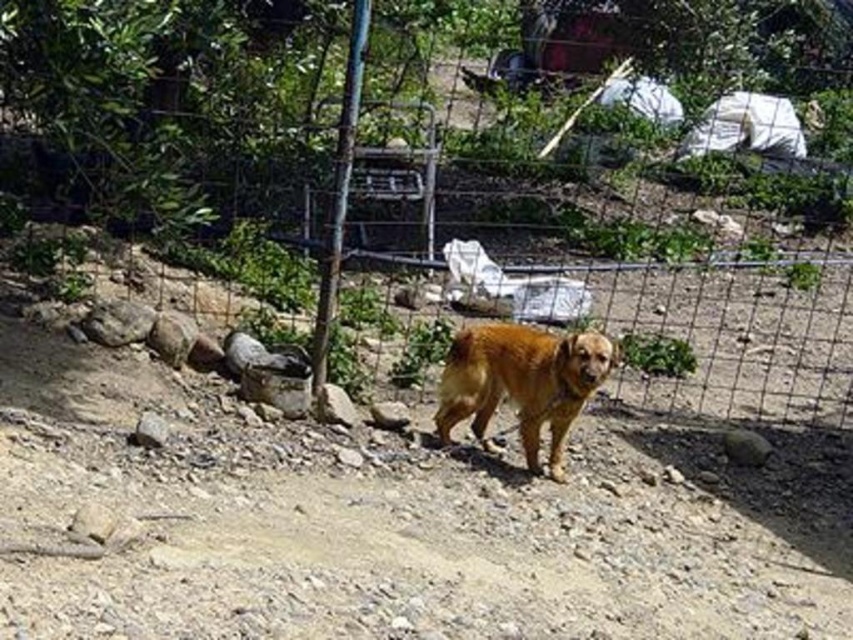
You are standing at the center of the image and want to walk towards the wire mesh fence at center. In which direction should you move to reach it?

Since the wire mesh fence at center is located at point coordinates of 0.267 on the x axis and 0.543 on the y axis, you should move towards the lower left direction to reach it.

You are standing at the edge of the brown dirt field at center and want to reach the golden fur dog at center. According to the scene, which direction should you move to get closer to the dog?

The brown dirt field at center is in front of the golden fur dog at center, so you should move backward to get closer to the dog.